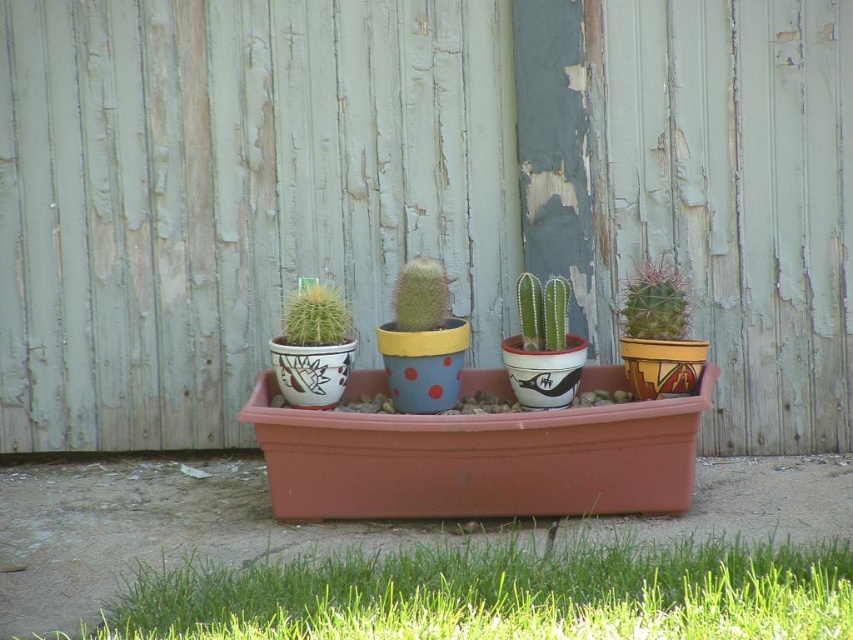
You are standing in front of the rectangular terracotta planter box with the small round cactus in white pot with black and red decorative patterns and the taller cylindrical cactus with fuzzy texture. If you want to reach both points, point 1 at coordinate (x=788, y=540) and point 2 at coordinate (x=672, y=314), which point would you need to extend your arm further to touch?

Point 2 at coordinate (x=672, y=314) is further away from the viewer than point 1 at coordinate (x=788, y=540). Therefore, you would need to extend your arm further to touch point 2 at coordinate (x=672, y=314).

You are a gardener who needs to water the cacti in the planter box. You have a watering can with a 12 inch long handle. If you are standing to the left of the sandy brown textured cactus at center, can you reach the green matte cactus at center without moving your feet?

The sandy brown textured cactus at center and green matte cactus at center are 14.72 inches apart from each other. Since the watering can handle is only 12 inches long, you cannot reach the green matte cactus at center without moving your feet.

You are standing in front of the cacti arrangement. There are two points marked on the image at coordinates point (643, 300) and point (566, 288). Which point is closer to you?

Point (566, 288) is closer to you since point (643, 300) is behind it.